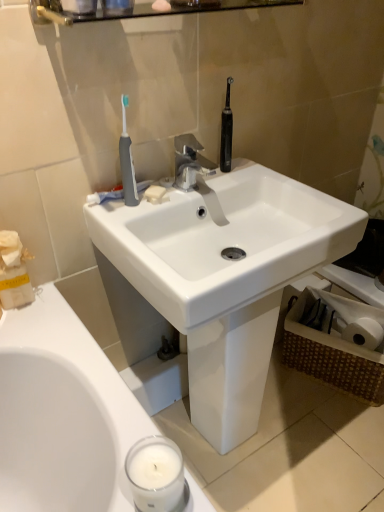
Image resolution: width=384 pixels, height=512 pixels. In order to click on empty space that is to the right of gray rubber toothbrush at upper left in this screenshot , I will do (x=195, y=192).